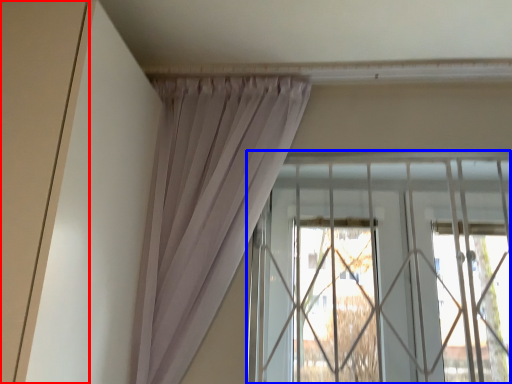
Question: Which object is further to the camera taking this photo, door (highlighted by a red box) or window (highlighted by a blue box)?

Choices:
 (A) door
 (B) window

Answer: (B)